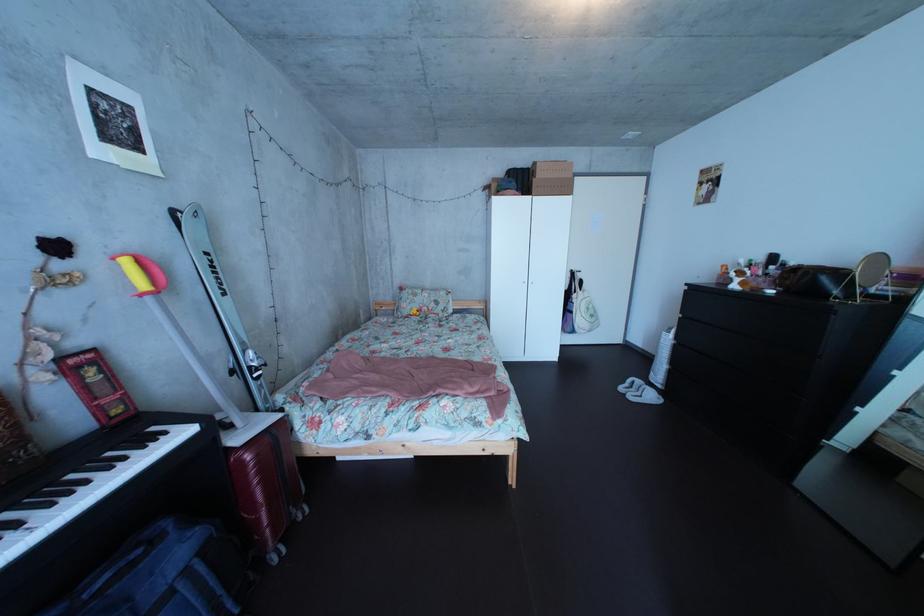
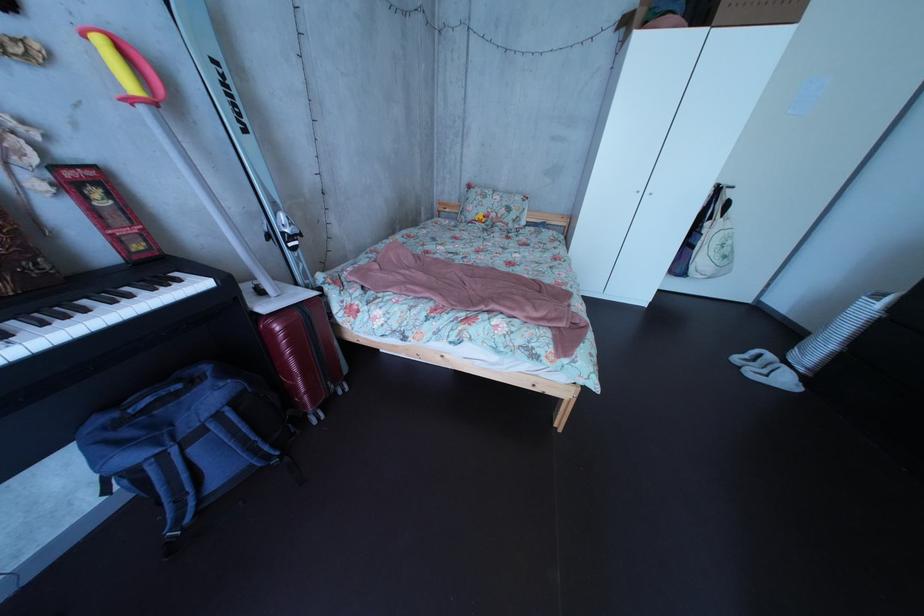
Locate, in the second image, the point that corresponds to (652,389) in the first image.

(784, 363)